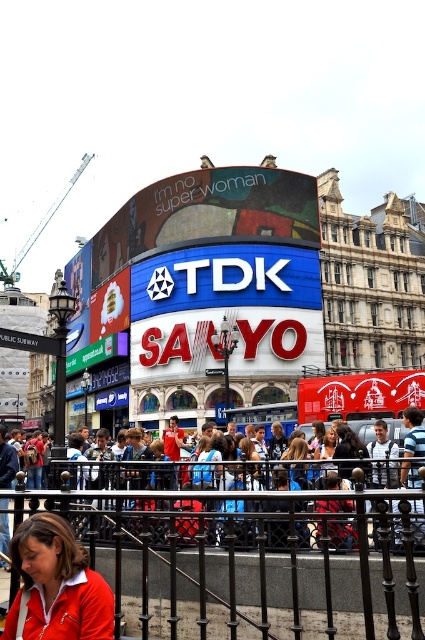
The width and height of the screenshot is (425, 640). Describe the element at coordinates (295, 449) in the screenshot. I see `matte blue shirt at center` at that location.

Is matte blue shirt at center thinner than matte black hair at center?

Yes, matte blue shirt at center is thinner than matte black hair at center.

Between point (303, 467) and point (317, 467), which one is positioned in front?

Positioned in front is point (317, 467).

The image size is (425, 640). In order to click on matte blue shirt at center in this screenshot , I will do `click(295, 449)`.

Which is more to the right, black wrought iron fence at lower center or blue denim jeans at lower center?

Positioned to the right is blue denim jeans at lower center.

Who is taller, black wrought iron fence at lower center or blue denim jeans at lower center?

black wrought iron fence at lower center is taller.

Between point (328, 628) and point (337, 524), which one is positioned in front?

Point (328, 628)

What are the coordinates of `black wrought iron fence at lower center` in the screenshot? It's located at (243, 550).

Can you confirm if matte red jacket at lower left is wider than matte blue shirt at center?

Yes.

Is matte red jacket at lower left positioned behind matte blue shirt at center?

No, it is in front of matte blue shirt at center.

Does point (93, 611) lie in front of point (299, 477)?

Yes, it is in front of point (299, 477).

The image size is (425, 640). I want to click on matte red jacket at lower left, so click(x=56, y=584).